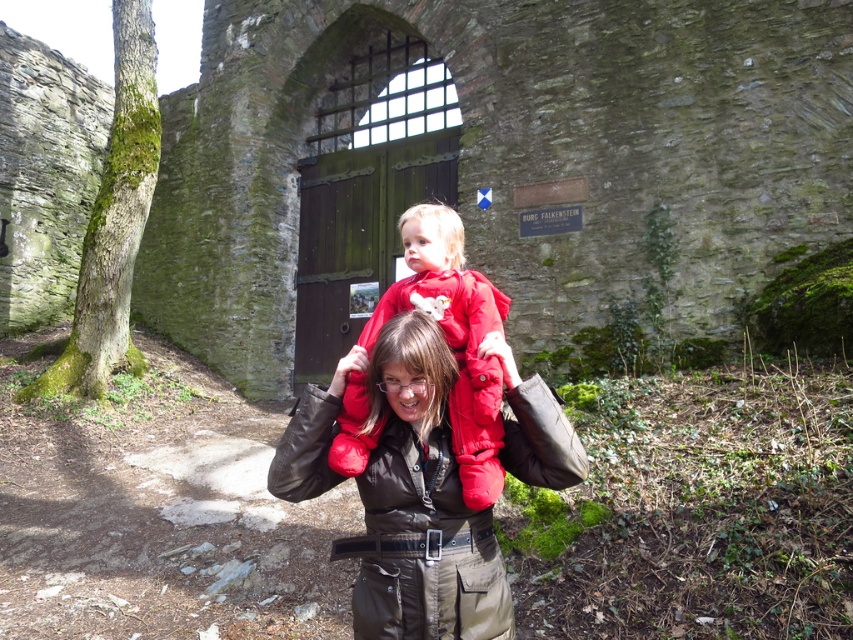
You are a photographer positioned at the entrance of the historical site. You need to capture a photo of the brown leather jacket at center without including the arched doorway in the background. Is the jacket positioned in a way that allows this?

The brown leather jacket at center is located at point (421, 508), which is away from the arched doorway in the background, so yes, it can be photographed without including the doorway.

You are a photographer trying to capture both the brown leather jacket at center and the matte red jacket at center in a single frame. Based on their heights, which jacket will appear larger in the photo?

The matte red jacket at center will appear larger in the photo because it is taller than the brown leather jacket at center.

You are a tailor who needs to determine which jacket, the brown leather jacket at center or the matte red jacket at center, requires more fabric for alterations. Based on the scene, which one would need more fabric?

Answer: The brown leather jacket at center requires more fabric for alterations because its width is larger than the matte red jacket at center, indicating it has a greater surface area.